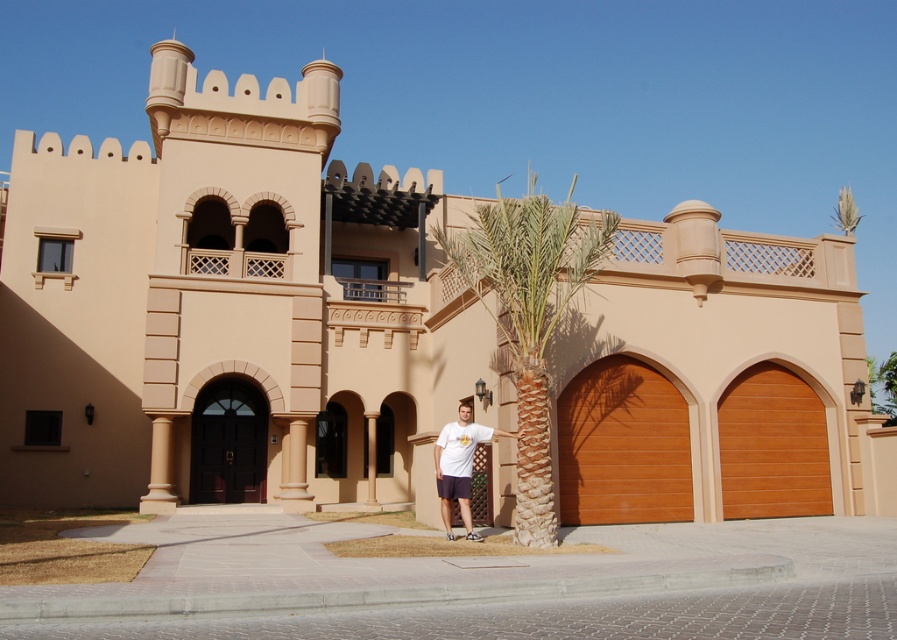
Where is `wooden at center`? This screenshot has width=897, height=640. wooden at center is located at coordinates point(623,445).

Identify the location of wooden at center. This screenshot has width=897, height=640. (623, 445).

The image size is (897, 640). I want to click on wooden at center, so click(623, 445).

Does dark brown wooden garage door at center appear on the left side of white cotton t-shirt at center?

Correct, you'll find dark brown wooden garage door at center to the left of white cotton t-shirt at center.

Is dark brown wooden garage door at center to the right of white cotton t-shirt at center from the viewer's perspective?

Incorrect, dark brown wooden garage door at center is not on the right side of white cotton t-shirt at center.

This screenshot has height=640, width=897. I want to click on dark brown wooden garage door at center, so click(228, 444).

Between point (624, 422) and point (469, 518), which one is positioned behind?

The point (624, 422) is behind.

Looking at this image, between wooden at center and white cotton t-shirt at center, which one appears on the left side from the viewer's perspective?

From the viewer's perspective, white cotton t-shirt at center appears more on the left side.

Is point (598, 408) positioned behind point (456, 444)?

Yes.

The image size is (897, 640). In order to click on wooden at center in this screenshot , I will do `click(623, 445)`.